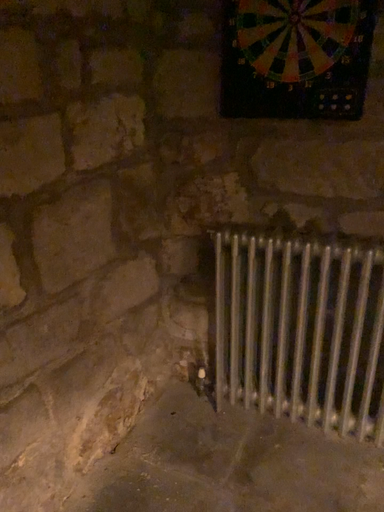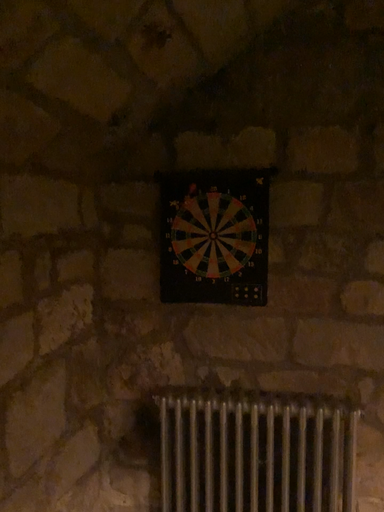
Question: How did the camera likely rotate when shooting the video?

Choices:
 (A) rotated left
 (B) rotated right

Answer: (B)